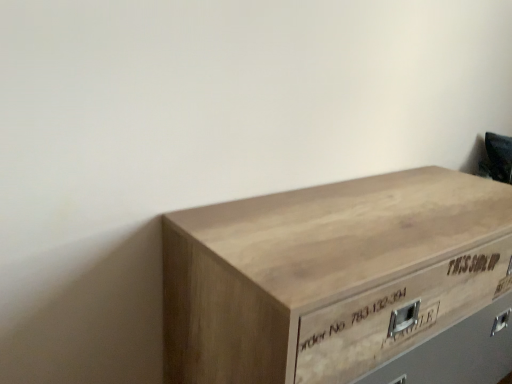
This screenshot has height=384, width=512. What do you see at coordinates (329, 275) in the screenshot?
I see `natural wood chest of drawers at center` at bounding box center [329, 275].

You are a GUI agent. You are given a task and a screenshot of the screen. Output one action in this format:
    pyautogui.click(x=<x>, y=<y>)
    Task: Click on the natural wood chest of drawers at center
    
    Given the screenshot: What is the action you would take?
    pyautogui.click(x=329, y=275)

What are the coordinates of `natural wood chest of drawers at center` in the screenshot? It's located at (329, 275).